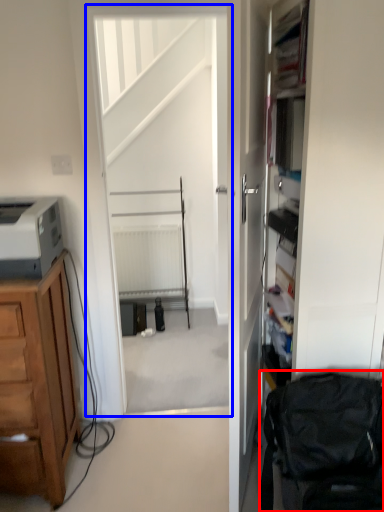
Question: Which of the following is the closest to the observer, swivel chair (highlighted by a red box) or screen door (highlighted by a blue box)?

Choices:
 (A) swivel chair
 (B) screen door

Answer: (A)